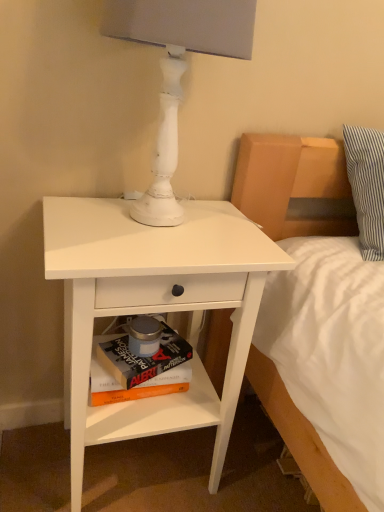
Image resolution: width=384 pixels, height=512 pixels. Identify the location of free point below white painted wood table lamp at upper center (from a real-world perspective). (157, 226).